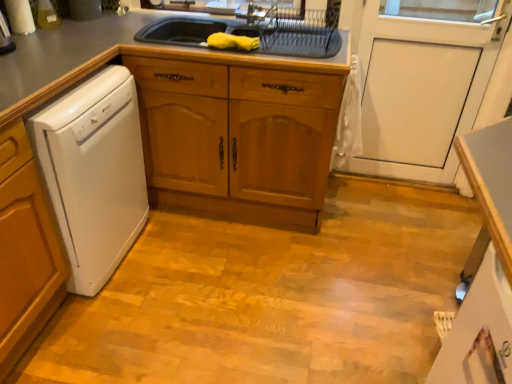
Question: Does gray matte countertop at upper center have a lesser width compared to white glossy counter at lower right?

Choices:
 (A) yes
 (B) no

Answer: (B)

Question: Can you confirm if gray matte countertop at upper center is taller than white glossy counter at lower right?

Choices:
 (A) yes
 (B) no

Answer: (A)

Question: Is white glossy counter at lower right a part of gray matte countertop at upper center?

Choices:
 (A) yes
 (B) no

Answer: (B)

Question: Does gray matte countertop at upper center have a lesser height compared to white glossy counter at lower right?

Choices:
 (A) no
 (B) yes

Answer: (A)

Question: From a real-world perspective, is gray matte countertop at upper center physically below white glossy counter at lower right?

Choices:
 (A) yes
 (B) no

Answer: (B)

Question: Relative to white matte door at center, is gray matte countertop at upper center in front or behind?

Choices:
 (A) front
 (B) behind

Answer: (A)

Question: From a real-world perspective, is gray matte countertop at upper center above or below white matte door at center?

Choices:
 (A) below
 (B) above

Answer: (A)

Question: Looking at the image, does gray matte countertop at upper center seem bigger or smaller compared to white matte door at center?

Choices:
 (A) small
 (B) big

Answer: (B)

Question: From the image's perspective, is gray matte countertop at upper center above or below white matte door at center?

Choices:
 (A) above
 (B) below

Answer: (B)

Question: Looking at their shapes, would you say metallic silver faucet at upper center is wider or thinner than white matte door at center?

Choices:
 (A) thin
 (B) wide

Answer: (B)

Question: Would you say metallic silver faucet at upper center is to the left or to the right of white matte door at center in the picture?

Choices:
 (A) left
 (B) right

Answer: (A)

Question: From the image's perspective, is metallic silver faucet at upper center located above or below white matte door at center?

Choices:
 (A) above
 (B) below

Answer: (A)

Question: From their relative heights in the image, would you say metallic silver faucet at upper center is taller or shorter than white matte door at center?

Choices:
 (A) short
 (B) tall

Answer: (A)

Question: Is white matte door at center taller or shorter than metallic silver faucet at upper center?

Choices:
 (A) tall
 (B) short

Answer: (A)

Question: Is point (375, 140) positioned closer to the camera than point (259, 6)?

Choices:
 (A) farther
 (B) closer

Answer: (A)